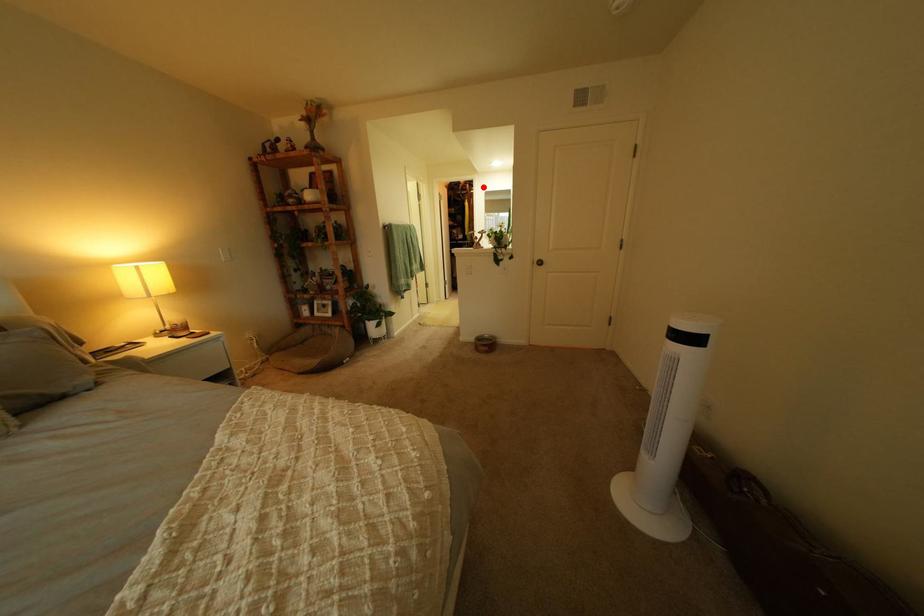
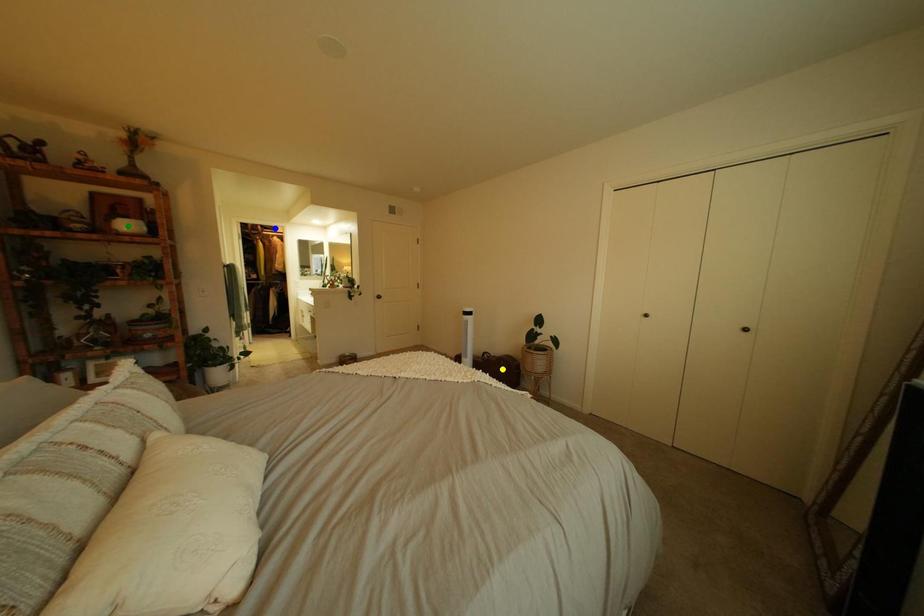
Question: I am providing you with two images of the same scene from different viewpoints. A red point is marked on the first image. You are given multiple points on the second image. Which spot in image 2 lines up with the point in image 1?

Choices:
 (A) green point
 (B) blue point
 (C) yellow point

Answer: (B)